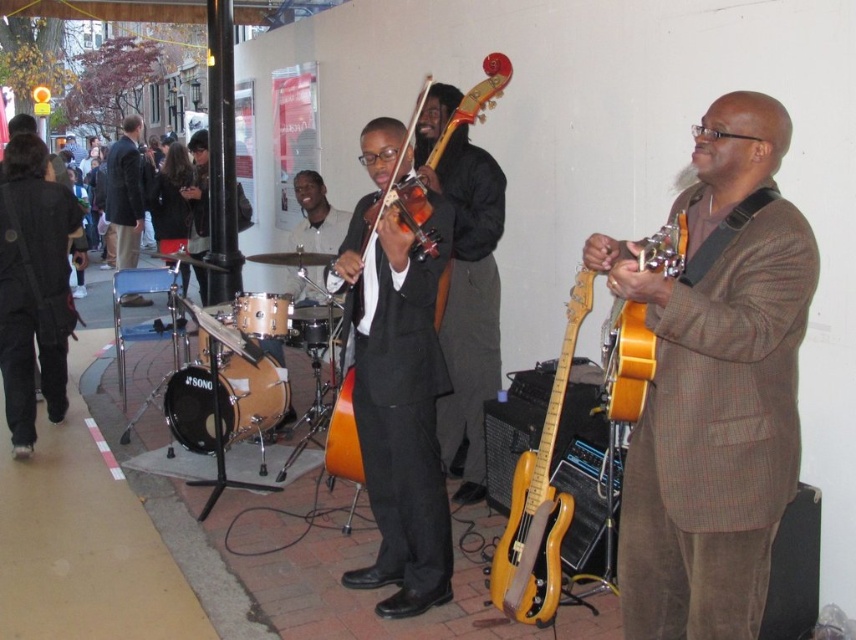
Question: Which object is closer to the camera taking this photo?

Choices:
 (A) matte yellow guitar at right
 (B) wooden drum at center
 (C) dark brown suit at left

Answer: (A)

Question: Considering the real-world distances, which object is farthest from the brown wooden drum at lower left?

Choices:
 (A) natural wood drum at center
 (B) orange glossy guitar at center
 (C) yellow matte electric guitar at center-right

Answer: (C)

Question: Does shiny black suit at center appear on the left side of natural wood drum at center?

Choices:
 (A) yes
 (B) no

Answer: (B)

Question: In this image, where is light brown leather drum set at center located relative to matte brown violin at center?

Choices:
 (A) right
 (B) left

Answer: (B)

Question: Can you confirm if matte black violin at center is wider than matte brown violin at center?

Choices:
 (A) yes
 (B) no

Answer: (B)

Question: Which point is farther to the camera?

Choices:
 (A) (217, 310)
 (B) (503, 552)
 (C) (488, 307)

Answer: (A)